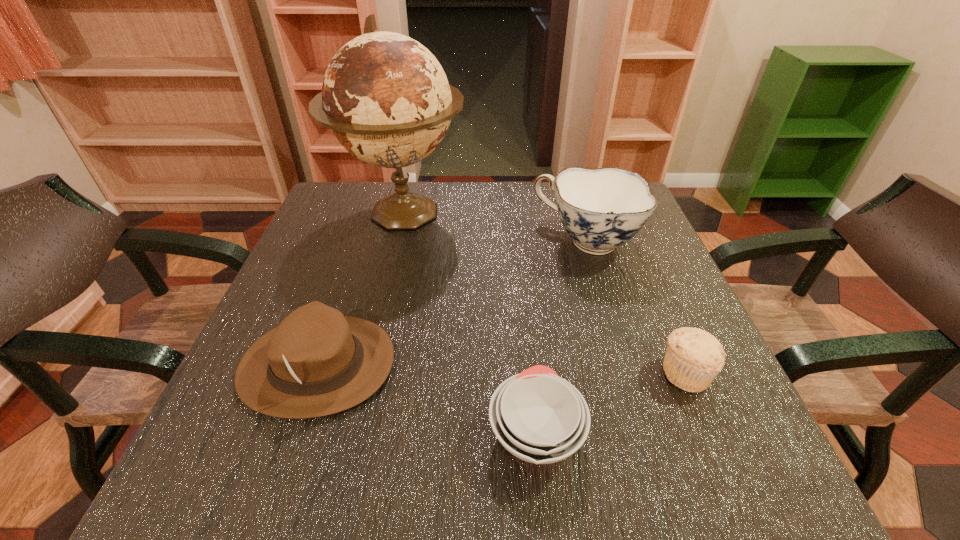
At what (x,y) coordinates should I click in order to perform the action: click on globe located in the far edge section of the desktop. Please return your answer as a coordinate pair (x, y). The height and width of the screenshot is (540, 960). Looking at the image, I should click on (386, 98).

This screenshot has height=540, width=960. In order to click on chinaware located at the far edge in this screenshot , I will do `click(601, 209)`.

Locate an element on the screen. This screenshot has width=960, height=540. object at the near edge is located at coordinates (539, 417).

This screenshot has width=960, height=540. What are the coordinates of `globe at the left edge` in the screenshot? It's located at (386, 98).

Where is `fedora that is at the left edge`? The height and width of the screenshot is (540, 960). fedora that is at the left edge is located at coordinates (317, 362).

You are a GUI agent. You are given a task and a screenshot of the screen. Output one action in this format:
    pyautogui.click(x=<x>, y=<y>)
    Task: Click on the chinaware at the right edge
    Image resolution: width=960 pixels, height=540 pixels.
    Given the screenshot: What is the action you would take?
    pyautogui.click(x=601, y=209)

At what (x,y) coordinates should I click in order to perform the action: click on muffin that is at the right edge. Please return your answer as a coordinate pair (x, y). The image size is (960, 540). Looking at the image, I should click on (694, 357).

Identify the location of object at the far left corner. (386, 98).

Locate an element on the screen. The width and height of the screenshot is (960, 540). object that is at the far right corner is located at coordinates (601, 209).

This screenshot has width=960, height=540. Identify the location of free region at the far edge. (556, 204).